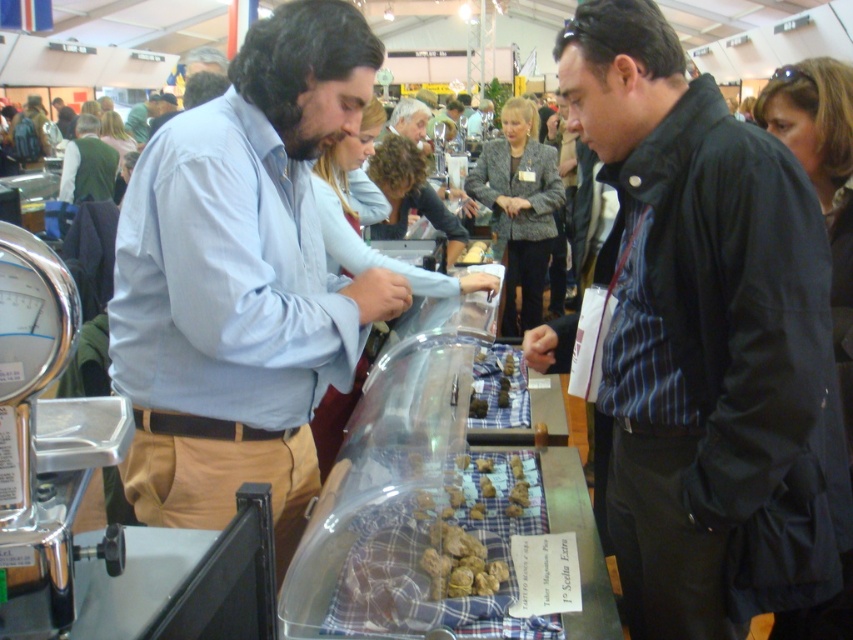
Question: Which point is farther to the camera?

Choices:
 (A) light blue shirt at center
 (B) black striped shirt at center

Answer: (A)

Question: Is the position of black striped shirt at center less distant than that of light blue shirt at center?

Choices:
 (A) yes
 (B) no

Answer: (A)

Question: Among these objects, which one is farthest from the camera?

Choices:
 (A) black striped shirt at center
 (B) light blue shirt at center

Answer: (B)

Question: Which of the following is the closest to the observer?

Choices:
 (A) light blue shirt at center
 (B) black striped shirt at center

Answer: (B)

Question: Does black striped shirt at center lie behind light blue shirt at center?

Choices:
 (A) yes
 (B) no

Answer: (B)

Question: Does black striped shirt at center have a lesser width compared to light blue shirt at center?

Choices:
 (A) no
 (B) yes

Answer: (A)